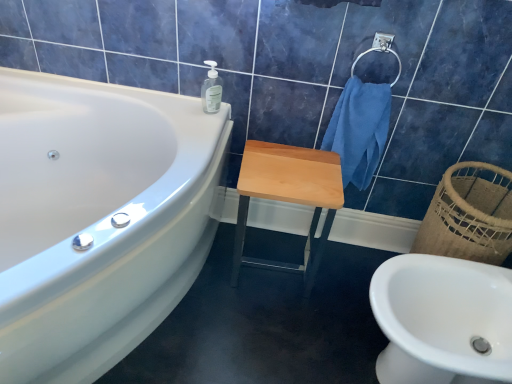
Find the location of a particular element. This screenshot has height=384, width=512. vacant region to the left of light wood/matte stool at center is located at coordinates (215, 268).